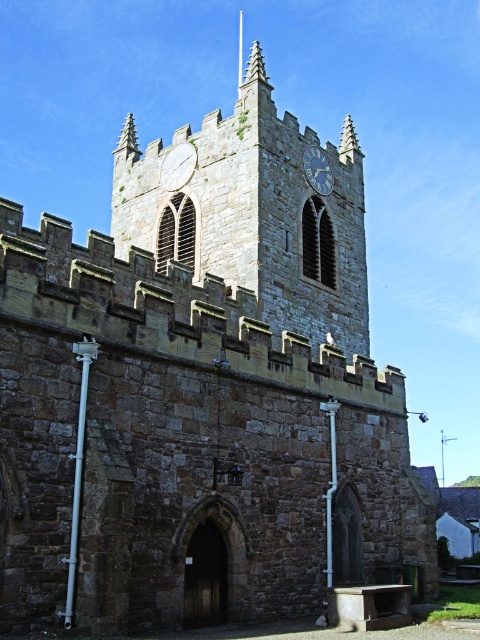
You are standing in front of the historic stone church tower. There is a point marked at coordinates (178, 166). What object is located at that point?

The stone clock at center is located at point (178, 166).

You are an architect designing a new building and want to incorporate elements from the historic stone church tower. You need to ensure that the width of your new clock matches the proportions of the original. Given that the stone clock tower at center is wider than the blue stone clock at upper center, which object should you use as a reference for the clock size to maintain the correct scale?

To maintain the correct scale, you should use the blue stone clock at upper center as a reference for the clock size since the stone clock tower at center is wider than the blue stone clock at upper center, indicating the clock is smaller in proportion to the tower.